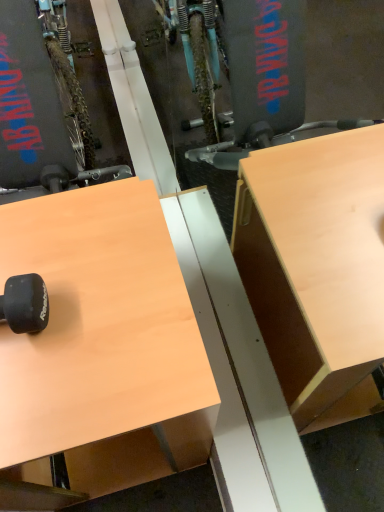
Image resolution: width=384 pixels, height=512 pixels. What do you see at coordinates (25, 304) in the screenshot?
I see `black rubber dumbbell at lower left` at bounding box center [25, 304].

Locate an element on the screen. black rubber dumbbell at lower left is located at coordinates (25, 304).

In order to face light brown wood desk at upper left, should I rotate leftwards or rightwards?

To face it directly, rotate left by 14.352 degrees.

You are a GUI agent. You are given a task and a screenshot of the screen. Output one action in this format:
    pyautogui.click(x=<x>, y=<y>)
    Task: Click on the light brown wood desk at upper left
    This screenshot has width=384, height=512.
    Given the screenshot: What is the action you would take?
    pyautogui.click(x=100, y=348)

This screenshot has height=512, width=384. Describe the element at coordinates (100, 348) in the screenshot. I see `light brown wood desk at upper left` at that location.

Find the location of a particular element. This screenshot has height=512, width=384. black rubber dumbbell at lower left is located at coordinates (25, 304).

Would you say light brown wood desk at upper left is to the left or to the right of black rubber dumbbell at lower left in the picture?

From the image, it's evident that light brown wood desk at upper left is to the right of black rubber dumbbell at lower left.

Between light brown wood desk at upper left and black rubber dumbbell at lower left, which one is positioned in front?

light brown wood desk at upper left is in front.

Considering the points (126, 183) and (31, 328), which point is behind, point (126, 183) or point (31, 328)?

Point (126, 183)

From the image's perspective, is light brown wood desk at upper left located above or below black rubber dumbbell at lower left?

light brown wood desk at upper left is situated lower than black rubber dumbbell at lower left in the image.

From a real-world perspective, which is physically above, light brown wood desk at upper left or black rubber dumbbell at lower left?

black rubber dumbbell at lower left is physically above.

Which object is thinner, light brown wood desk at upper left or black rubber dumbbell at lower left?

With smaller width is black rubber dumbbell at lower left.

Considering the sizes of objects light brown wood desk at upper left and black rubber dumbbell at lower left in the image provided, who is shorter, light brown wood desk at upper left or black rubber dumbbell at lower left?

black rubber dumbbell at lower left is shorter.

Is light brown wood desk at upper left bigger than black rubber dumbbell at lower left?

Yes.

Is light brown wood desk at upper left not within black rubber dumbbell at lower left?

Yes, light brown wood desk at upper left is located beyond the bounds of black rubber dumbbell at lower left.

Consider the image. Is light brown wood desk at upper left next to black rubber dumbbell at lower left?

light brown wood desk at upper left and black rubber dumbbell at lower left are not in contact.

Based on the photo, is light brown wood desk at upper left oriented away from black rubber dumbbell at lower left?

No, light brown wood desk at upper left is not facing away from black rubber dumbbell at lower left.

Can you tell me how much light brown wood desk at upper left and black rubber dumbbell at lower left differ in facing direction?

light brown wood desk at upper left and black rubber dumbbell at lower left are facing 1.64 degrees away from each other.

You are a GUI agent. You are given a task and a screenshot of the screen. Output one action in this format:
    pyautogui.click(x=<x>, y=<y>)
    Task: Click on the wheel above the light brown wood desk at upper left (from the image's perspective)
    This screenshot has width=384, height=512.
    Given the screenshot: What is the action you would take?
    pyautogui.click(x=25, y=304)

Considering the positions of objects black rubber dumbbell at lower left and light brown wood desk at upper left in the image provided, who is more to the left, black rubber dumbbell at lower left or light brown wood desk at upper left?

black rubber dumbbell at lower left is more to the left.

Is black rubber dumbbell at lower left further to camera compared to light brown wood desk at upper left?

Yes, the depth of black rubber dumbbell at lower left is greater than that of light brown wood desk at upper left.

Between point (41, 298) and point (12, 245), which one is positioned behind?

The point (12, 245) is farther.

From the image's perspective, which one is positioned lower, black rubber dumbbell at lower left or light brown wood desk at upper left?

light brown wood desk at upper left, from the image's perspective.

From a real-world perspective, is black rubber dumbbell at lower left under light brown wood desk at upper left?

No, from a real-world perspective, black rubber dumbbell at lower left is not below light brown wood desk at upper left.

Considering the relative sizes of black rubber dumbbell at lower left and light brown wood desk at upper left in the image provided, is black rubber dumbbell at lower left thinner than light brown wood desk at upper left?

Yes, black rubber dumbbell at lower left is thinner than light brown wood desk at upper left.

From their relative heights in the image, would you say black rubber dumbbell at lower left is taller or shorter than light brown wood desk at upper left?

Clearly, black rubber dumbbell at lower left is shorter compared to light brown wood desk at upper left.

Does black rubber dumbbell at lower left have a larger size compared to light brown wood desk at upper left?

No.

Which is correct: black rubber dumbbell at lower left is inside light brown wood desk at upper left, or outside of it?

black rubber dumbbell at lower left is not inside light brown wood desk at upper left, it's outside.

Is black rubber dumbbell at lower left positioned far away from light brown wood desk at upper left?

No, black rubber dumbbell at lower left is in close proximity to light brown wood desk at upper left.

Is black rubber dumbbell at lower left looking in the opposite direction of light brown wood desk at upper left?

No, black rubber dumbbell at lower left's orientation is not away from light brown wood desk at upper left.

How different are the orientations of black rubber dumbbell at lower left and light brown wood desk at upper left in degrees?

black rubber dumbbell at lower left and light brown wood desk at upper left are facing 1.64 degrees away from each other.

You are a GUI agent. You are given a task and a screenshot of the screen. Output one action in this format:
    pyautogui.click(x=<x>, y=<y>)
    Task: Click on the wheel behind the light brown wood desk at upper left
    
    Given the screenshot: What is the action you would take?
    pyautogui.click(x=25, y=304)

Locate an element on the screen. Image resolution: width=384 pixels, height=512 pixels. desk on the right of black rubber dumbbell at lower left is located at coordinates (100, 348).

Find the location of `wheel that appears behind the light brown wood desk at upper left`. wheel that appears behind the light brown wood desk at upper left is located at coordinates (25, 304).